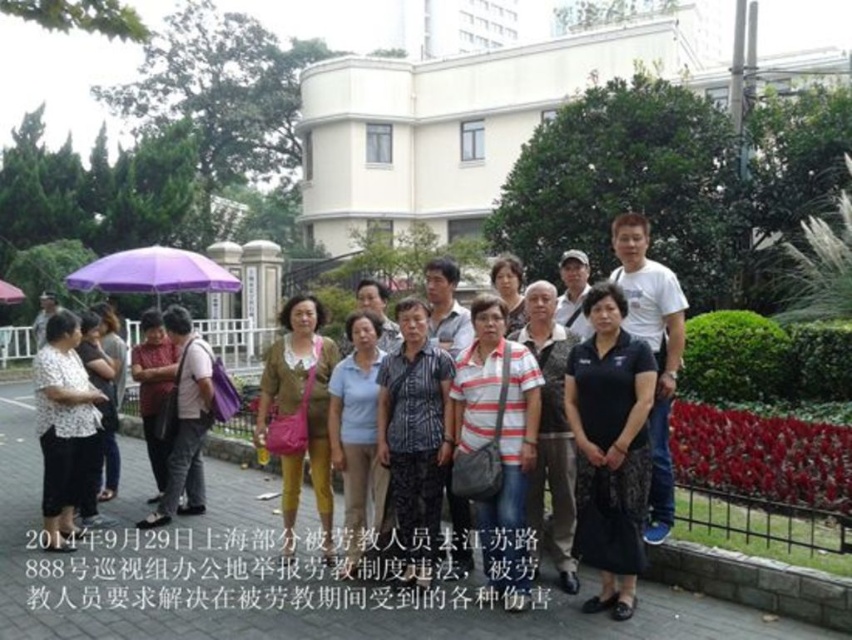
Question: Among these points, which one is farthest from the camera?

Choices:
 (A) (363, 461)
 (B) (585, 438)

Answer: (A)

Question: Considering the relative positions of black fabric dress at center and matte black shirt at center in the image provided, where is black fabric dress at center located with respect to matte black shirt at center?

Choices:
 (A) above
 (B) below

Answer: (B)

Question: Which point is closer to the camera taking this photo?

Choices:
 (A) (15, 289)
 (B) (519, 460)
 (C) (300, 368)

Answer: (B)

Question: Does matte black dress at lower left appear under matte black shirt at center?

Choices:
 (A) yes
 (B) no

Answer: (A)

Question: Which object is positioned closest to the black fabric dress at center?

Choices:
 (A) striped cotton shirt at center
 (B) matte black shirt at center
 (C) matte black dress at lower left

Answer: (A)

Question: Is striped cotton shirt at center behind matte brown jacket at center?

Choices:
 (A) no
 (B) yes

Answer: (A)